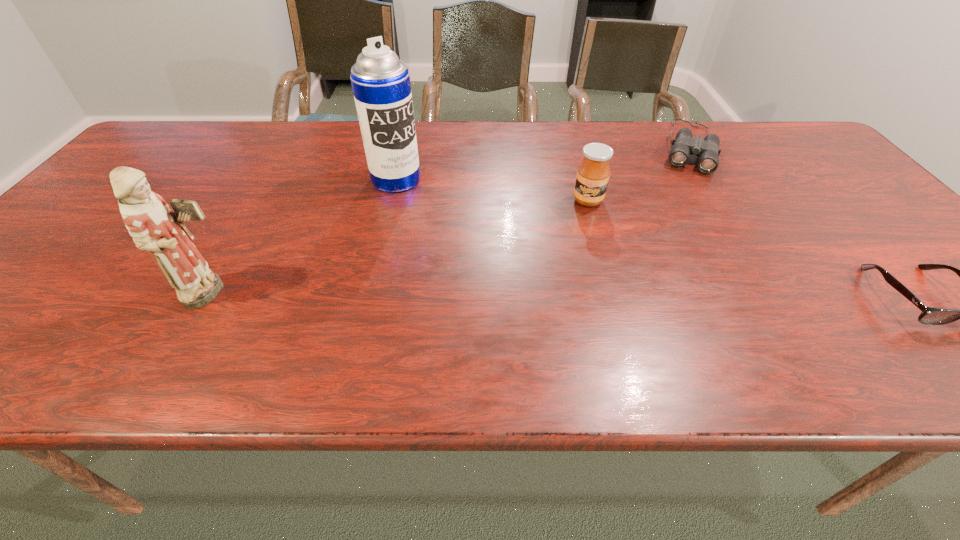
Identify the location of vacant space situated 0.170m on the front-facing side of the honey. (586, 255).

Identify the location of free region located 0.290m at the eyepiece of the binoculars. pyautogui.click(x=679, y=237).

Find the location of `vacant position located 0.190m at the eyepiece of the binoculars`. vacant position located 0.190m at the eyepiece of the binoculars is located at coordinates (684, 213).

The image size is (960, 540). I want to click on free space located 0.050m at the eyepiece of the binoculars, so click(x=689, y=184).

The height and width of the screenshot is (540, 960). I want to click on vacant space located on the label side of the tallest object, so click(454, 239).

You are a GUI agent. You are given a task and a screenshot of the screen. Output one action in this format:
    pyautogui.click(x=<x>, y=<y>)
    Task: Click on the vacant region located 0.290m on the label side of the tallest object
    The image size is (960, 540).
    Given the screenshot: What is the action you would take?
    pyautogui.click(x=468, y=254)

Locate an element on the screen. Image resolution: width=960 pixels, height=540 pixels. free space located on the label side of the tallest object is located at coordinates (468, 254).

Where is `object located in the far edge section of the desktop`? The width and height of the screenshot is (960, 540). object located in the far edge section of the desktop is located at coordinates (707, 150).

Where is `object positioned at the near edge`? Image resolution: width=960 pixels, height=540 pixels. object positioned at the near edge is located at coordinates (154, 227).

Locate an element on the screen. The height and width of the screenshot is (540, 960). vacant space at the far edge is located at coordinates (198, 152).